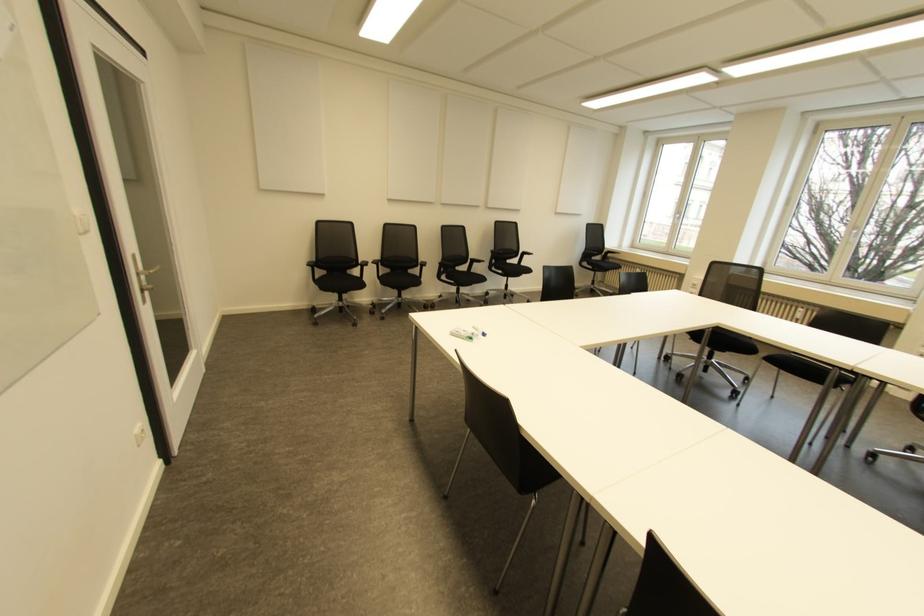
Where would you turn the white window handle? Please return your answer as a coordinate pair (x, y).

(854, 235)